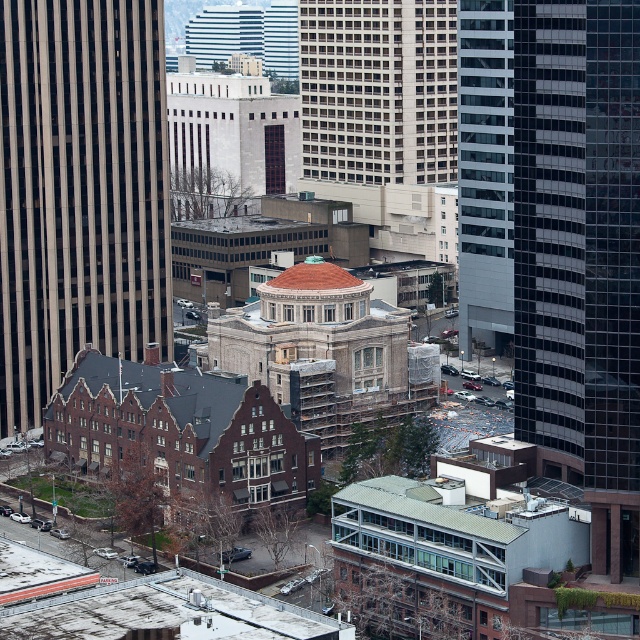
Question: Among these points, which one is nearest to the camera?

Choices:
 (A) (58, 256)
 (B) (170, 112)

Answer: (A)

Question: Among these points, which one is farthest from the camera?

Choices:
 (A) (202, 211)
 (B) (76, 257)

Answer: (A)

Question: Does beige glass skyscraper at left appear under beige stone building at center?

Choices:
 (A) no
 (B) yes

Answer: (B)

Question: Does beige glass skyscraper at left appear on the left side of beige stone building at center?

Choices:
 (A) yes
 (B) no

Answer: (A)

Question: Is beige glass skyscraper at left closer to camera compared to beige stone building at center?

Choices:
 (A) yes
 (B) no

Answer: (A)